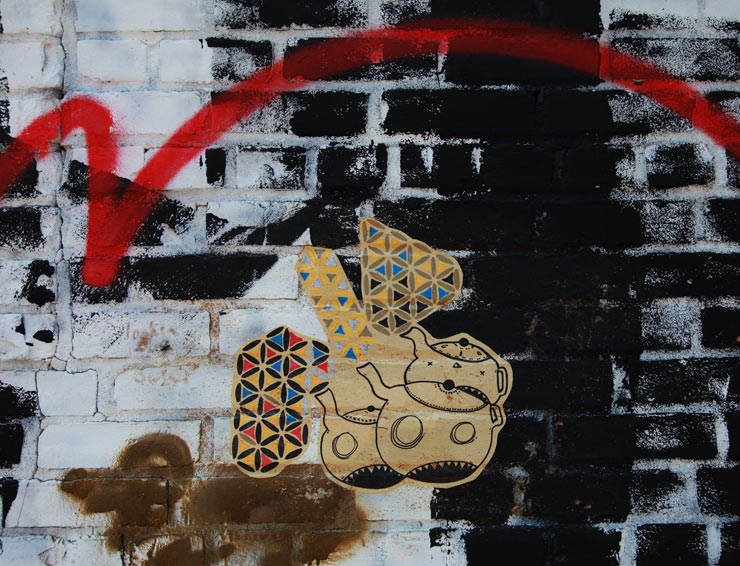
Where is `brown stain on wall`? Image resolution: width=740 pixels, height=566 pixels. brown stain on wall is located at coordinates (127, 488), (252, 518).